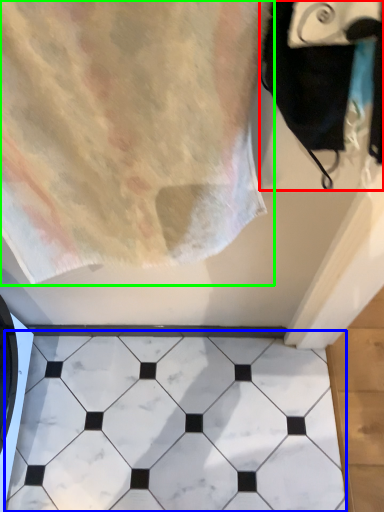
Question: Which object is positioned closest to bath towel (highlighted by a red box)? Select from marble (highlighted by a blue box) and towel (highlighted by a green box).

Choices:
 (A) marble
 (B) towel

Answer: (B)